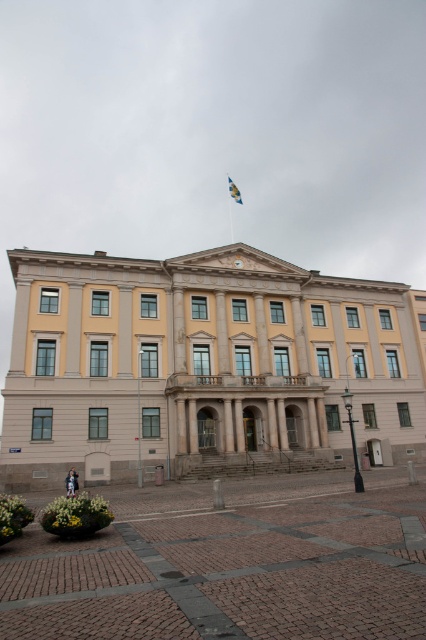
At what (x,y) coordinates should I click in order to perform the action: click on yellow stone building at center. Please return your answer as a coordinate pair (x, y). Looking at the image, I should click on (x=203, y=364).

Between yellow stone building at center and brick paving at center, which one appears on the right side from the viewer's perspective?

yellow stone building at center is more to the right.

The height and width of the screenshot is (640, 426). I want to click on yellow stone building at center, so click(203, 364).

Who is higher up, brick paving at center or blue fabric flag at upper center?

blue fabric flag at upper center is higher up.

What do you see at coordinates (230, 563) in the screenshot? This screenshot has width=426, height=640. I see `brick paving at center` at bounding box center [230, 563].

Identify the location of brick paving at center. (230, 563).

Which is behind, point (43, 417) or point (239, 200)?

Point (239, 200)

Is point (386, 298) farther from viewer compared to point (230, 182)?

No, (386, 298) is in front of (230, 182).

Describe the element at coordinates (203, 364) in the screenshot. I see `yellow stone building at center` at that location.

You are a GUI agent. You are given a task and a screenshot of the screen. Output one action in this format:
    pyautogui.click(x=<x>, y=<y>)
    Task: Click on the yellow stone building at center
    
    Given the screenshot: What is the action you would take?
    pyautogui.click(x=203, y=364)